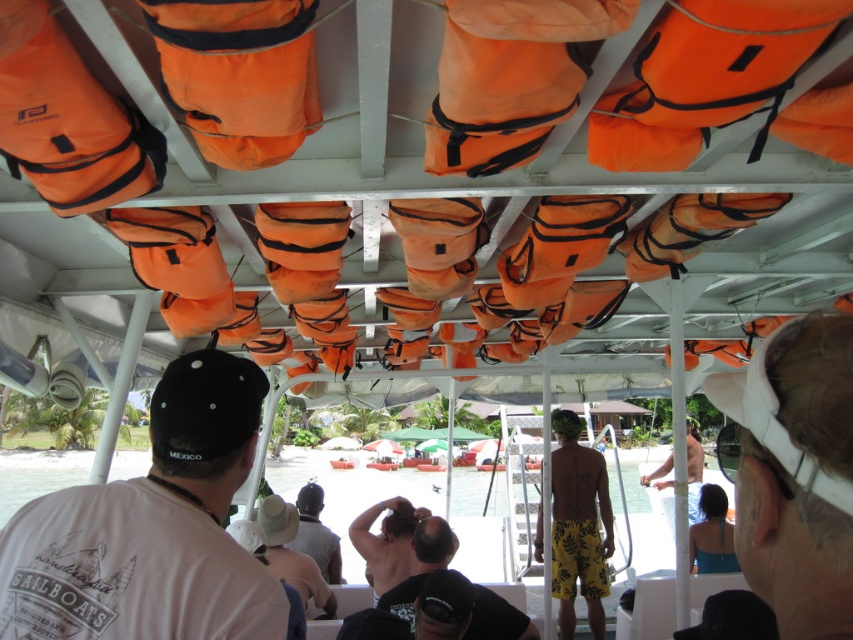
Between white matte sunglasses at upper right and beige fabric hat at center, which one has more height?

beige fabric hat at center is taller.

Does point (830, 577) come closer to viewer compared to point (317, 564)?

Yes, it is in front of point (317, 564).

I want to click on white matte sunglasses at upper right, so [798, 476].

Measure the distance between white matte shirt at center and camera.

They are 35.55 inches apart.

Can you confirm if white matte shirt at center is positioned below beige fabric hat at center?

No, white matte shirt at center is not below beige fabric hat at center.

Between point (160, 404) and point (292, 509), which one is positioned behind?

Positioned behind is point (292, 509).

In order to click on white matte shirt at center in this screenshot , I will do `click(151, 529)`.

Can you confirm if shiny brown hair at center is shorter than beige fabric hat at center?

In fact, shiny brown hair at center may be taller than beige fabric hat at center.

Can you confirm if shiny brown hair at center is thinner than beige fabric hat at center?

Yes, shiny brown hair at center is thinner than beige fabric hat at center.

Locate an element on the screen. shiny brown hair at center is located at coordinates (386, 541).